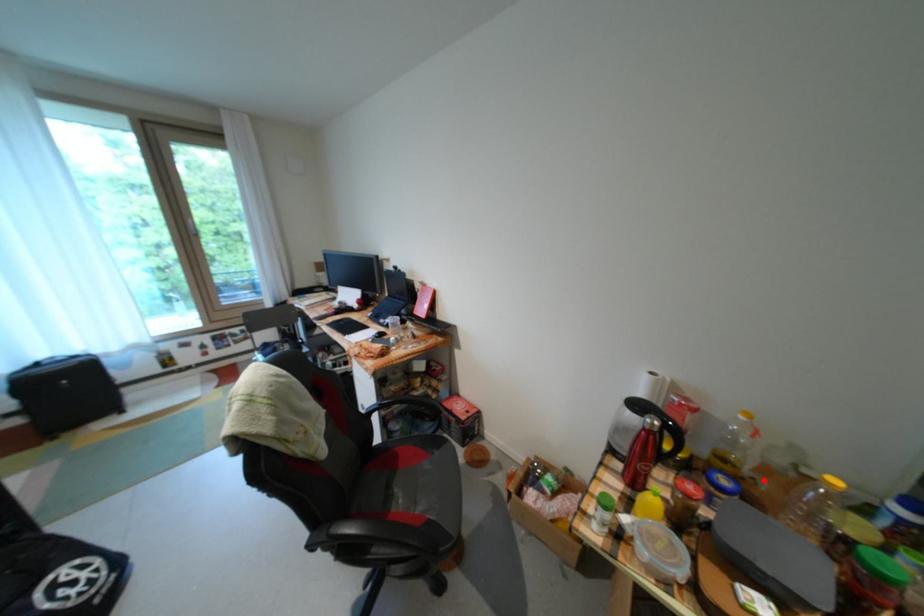
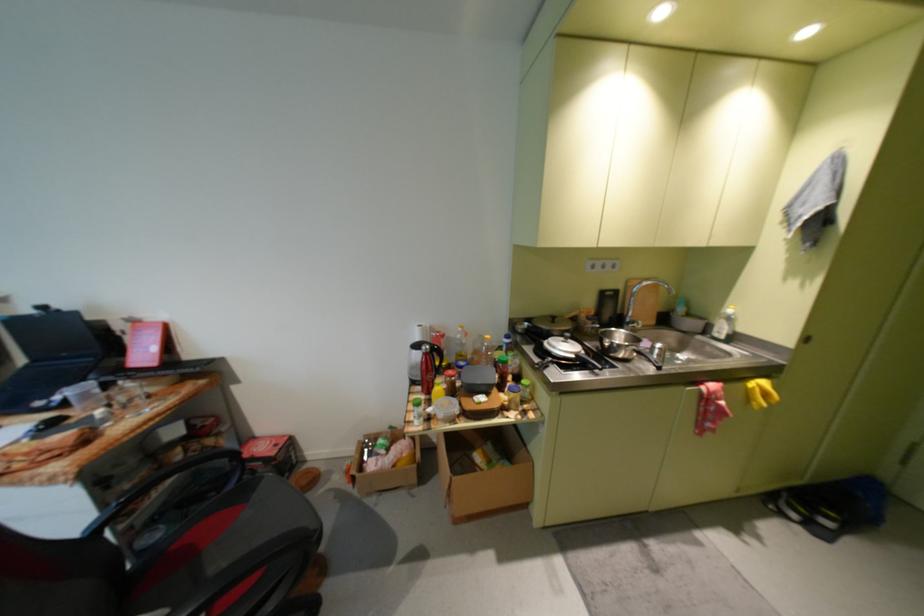
Question: I am providing you with two images of the same scene from different viewpoints. Given a red point in image1, look at the same physical point in image2. Is it:

Choices:
 (A) Closer to the viewpoint
 (B) Farther from the viewpoint

Answer: (A)